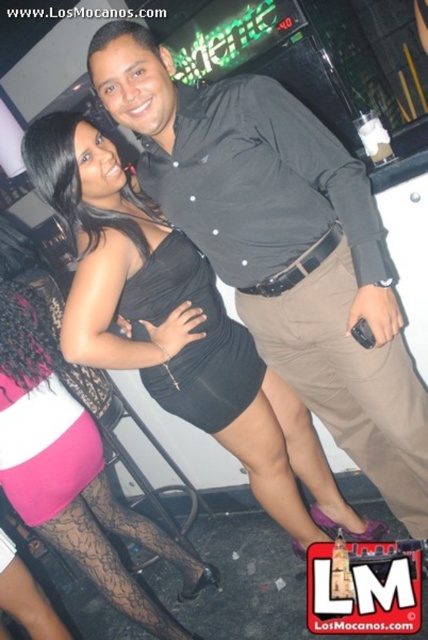
You are a photographer setting up a shoot in a dimly lit nightclub. You have two outfits to photograph against a neon sign backdrop. The outfits are the black cotton shirt at center and the black satin dress at center. Since the lighting is tricky, you want to ensure the camera can capture details of both outfits clearly. Which outfit has a larger width that might require more space in the frame?

The black cotton shirt at center has a larger width than the black satin dress at center, so it might require more space in the frame.

Looking at this image, in the image, there are two people. The woman on the left is wearing a black sleeveless dress and black lace stockings. The point marked as point (73, 472) corresponds to the black lace stockings at lower left. If you were to draw a straight line from the center of the image to this point, would it pass through the woman on the left?

Yes, the straight line from the center of the image to point (73, 472) would pass through the woman on the left because the point corresponds to her black lace stockings at lower left, which are part of her attire.